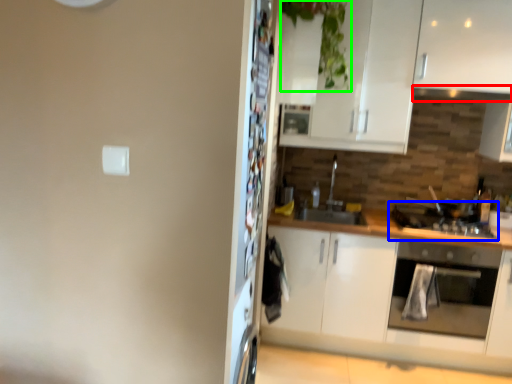
Question: Which object is positioned farthest from exhaust hood (highlighted by a red box)? Select from gas stove (highlighted by a blue box) and plant (highlighted by a green box).

Choices:
 (A) gas stove
 (B) plant

Answer: (B)